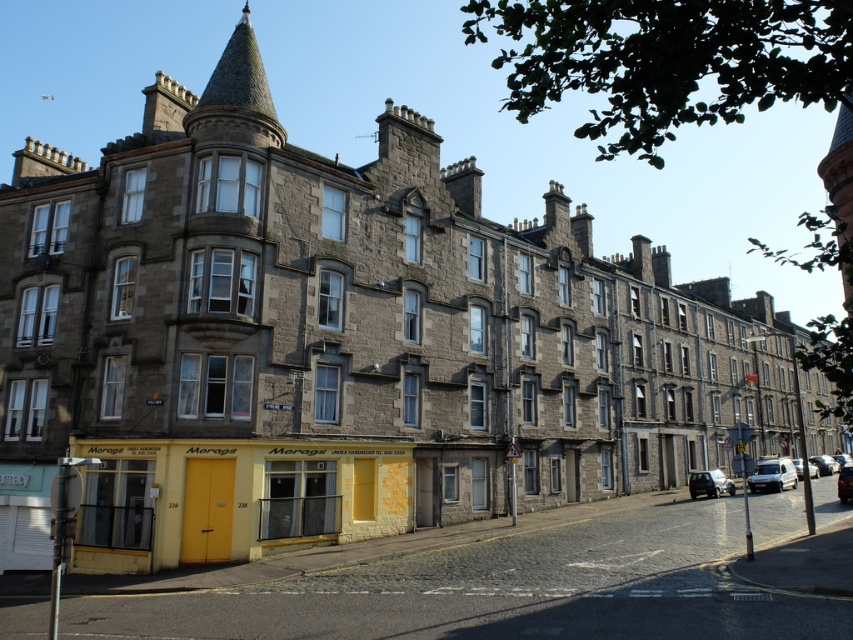
Question: Considering the relative positions of metallic silver car at center and silver metallic car at center in the image provided, where is metallic silver car at center located with respect to silver metallic car at center?

Choices:
 (A) left
 (B) right

Answer: (A)

Question: Among these objects, which one is nearest to the camera?

Choices:
 (A) silver metallic car at center
 (B) metallic silver car at lower right
 (C) metallic silver car at center
 (D) white matte van at lower right

Answer: (C)

Question: Is metallic silver car at lower right behind silver metallic car at center?

Choices:
 (A) yes
 (B) no

Answer: (B)

Question: Which is farther from the silver metallic car at center?

Choices:
 (A) metallic silver car at lower right
 (B) white matte van at lower right
 (C) metallic silver car at center

Answer: (A)

Question: Observing the image, what is the correct spatial positioning of white matte van at lower right in reference to silver metallic car at center?

Choices:
 (A) right
 (B) left

Answer: (B)

Question: Which of the following is the farthest from the observer?

Choices:
 (A) (699, 472)
 (B) (776, 458)
 (C) (799, 464)

Answer: (B)